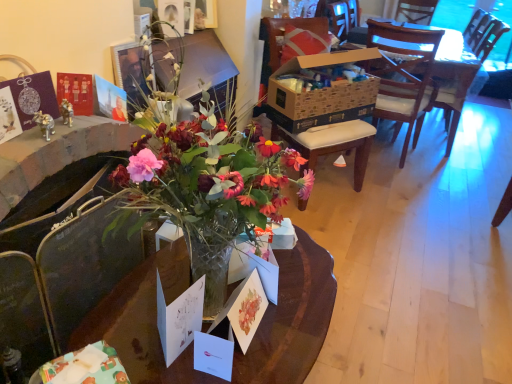
Locate an element on the screen. The width and height of the screenshot is (512, 384). free point below wooden armchair at center (from a real-world perspective) is located at coordinates (431, 141).